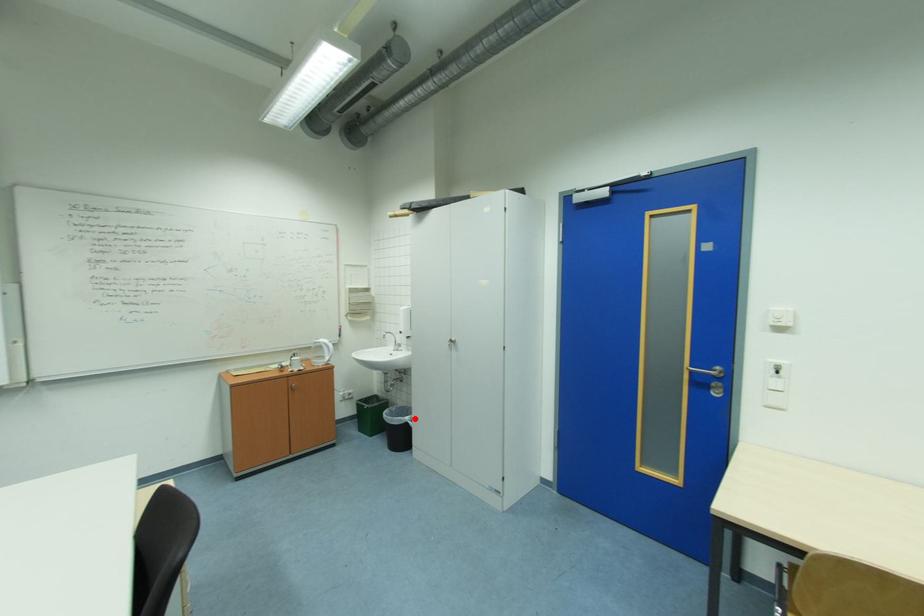
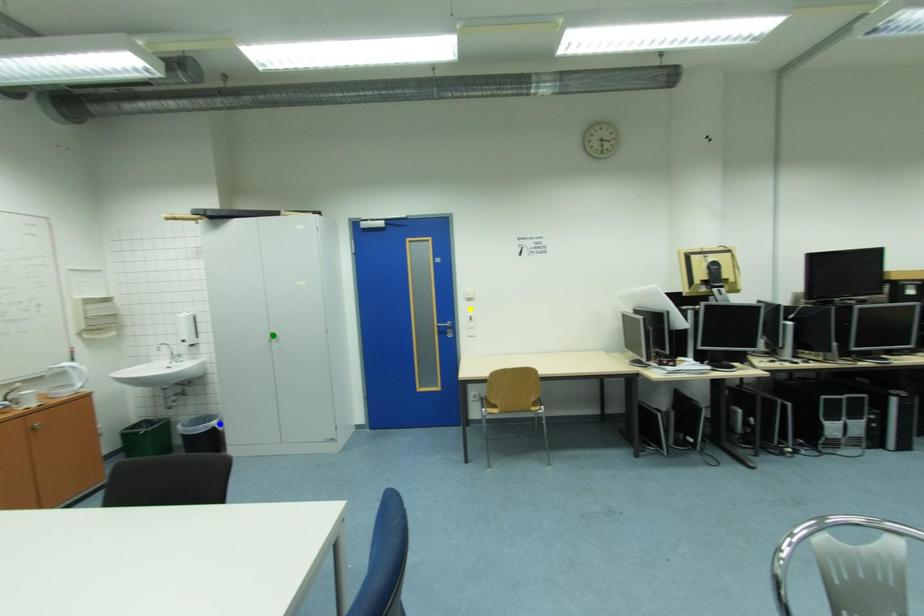
Question: I am providing you with two images of the same scene from different viewpoints. A red point is marked on the first image. You are given multiple points on the second image. Which point in image 2 is actually the same real-world point as the red point in image 1?

Choices:
 (A) yellow point
 (B) green point
 (C) blue point

Answer: (C)